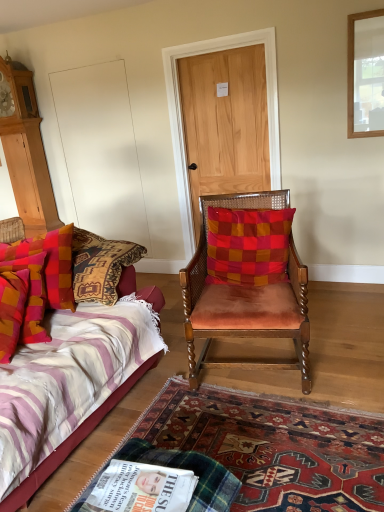
Where is `free point above carpeted rug at lower center (from a real-world perspective)`? free point above carpeted rug at lower center (from a real-world perspective) is located at coordinates (282, 449).